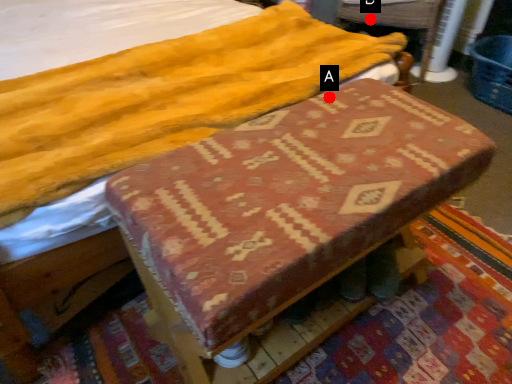
Question: Two points are circled on the image, labeled by A and B beside each circle. Among these points, which one is farthest from the camera?

Choices:
 (A) A is further
 (B) B is further

Answer: (B)